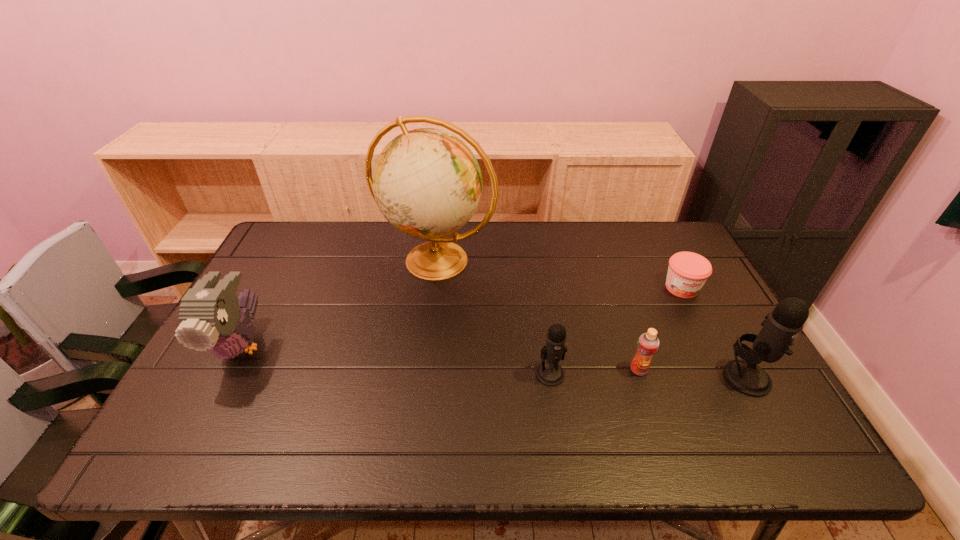
Find the location of `the fourth object from left to right`. the fourth object from left to right is located at coordinates (648, 343).

Locate an element on the screen. The image size is (960, 540). vacant space situated 0.270m on the left of the shorter microphone is located at coordinates (427, 374).

In order to click on vacant space located on the back of the right microphone in this screenshot , I will do `click(693, 280)`.

The image size is (960, 540). I want to click on vacant space situated on the left of the tallest object, so click(x=274, y=260).

Find the location of a particular element. The image size is (960, 540). free space located 0.060m at the beak of the bird is located at coordinates (210, 404).

The width and height of the screenshot is (960, 540). I want to click on vacant space located on the front label of the shortest object, so coord(699,321).

I want to click on free region located 0.120m on the right of the orange juice, so click(695, 370).

Locate an element on the screen. This screenshot has width=960, height=540. object that is at the far edge is located at coordinates (427, 183).

The width and height of the screenshot is (960, 540). Find the location of `object that is at the left edge`. object that is at the left edge is located at coordinates (211, 315).

Image resolution: width=960 pixels, height=540 pixels. Find the location of `microphone positioned at the right edge`. microphone positioned at the right edge is located at coordinates (783, 324).